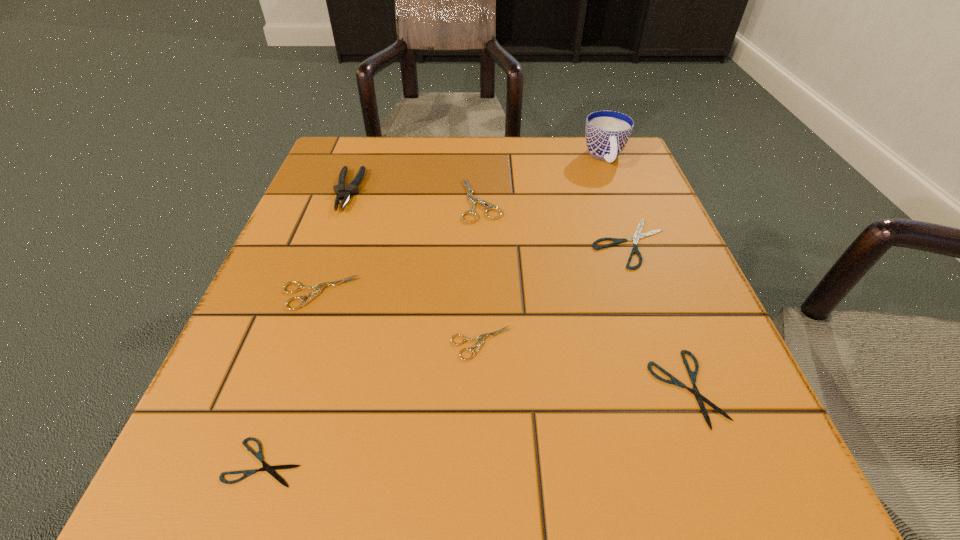
This screenshot has height=540, width=960. Identify the location of cup. (607, 132).

Where is `the tallest object`? Image resolution: width=960 pixels, height=540 pixels. the tallest object is located at coordinates (607, 132).

Find the location of `the second tallest object`. the second tallest object is located at coordinates (352, 188).

You are a GUI agent. You are given a task and a screenshot of the screen. Output one action in this format:
    pyautogui.click(x=<x>, y=<y>)
    Task: Click on the pliers
    
    Given the screenshot: What is the action you would take?
    pyautogui.click(x=352, y=188)

Locate an element on the screen. the sixth shortest object is located at coordinates point(472,200).

I want to click on the farthest beige shears, so click(x=472, y=200).

At what (x,y) coordinates should I click in order to perform the action: click on the second farthest beige shears. Please return your answer as a coordinate pair (x, y). Image resolution: width=960 pixels, height=540 pixels. Looking at the image, I should click on (318, 288).

What are the coordinates of `the third farthest shears` in the screenshot? It's located at click(x=318, y=288).

Find the location of `the farthest black shears`. the farthest black shears is located at coordinates (637, 236).

The width and height of the screenshot is (960, 540). In order to click on the smallest beige shears in this screenshot , I will do `click(480, 338)`.